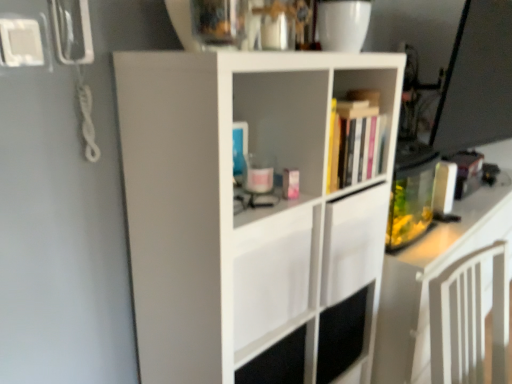
Question: Should I look upward or downward to see hardcover books at upper center?

Choices:
 (A) up
 (B) down

Answer: (A)

Question: Can we say hardcover books at upper center lies outside white matte cupboard at center?

Choices:
 (A) yes
 (B) no

Answer: (B)

Question: Is hardcover books at upper center oriented away from white matte cupboard at center?

Choices:
 (A) no
 (B) yes

Answer: (B)

Question: Is hardcover books at upper center wider than white matte cupboard at center?

Choices:
 (A) yes
 (B) no

Answer: (B)

Question: From a real-world perspective, is hardcover books at upper center over white matte cupboard at center?

Choices:
 (A) no
 (B) yes

Answer: (B)

Question: Is hardcover books at upper center not close to white matte cupboard at center?

Choices:
 (A) yes
 (B) no

Answer: (B)

Question: Could white matte cupboard at center be considered to be inside hardcover books at upper center?

Choices:
 (A) no
 (B) yes

Answer: (A)

Question: Are white matte cupboard at center and hardcover books at upper center beside each other?

Choices:
 (A) no
 (B) yes

Answer: (A)

Question: From the image's perspective, would you say white matte cupboard at center is positioned over hardcover books at upper center?

Choices:
 (A) no
 (B) yes

Answer: (A)

Question: Does white matte cupboard at center appear on the left side of hardcover books at upper center?

Choices:
 (A) no
 (B) yes

Answer: (B)

Question: Can you confirm if white matte cupboard at center is shorter than hardcover books at upper center?

Choices:
 (A) no
 (B) yes

Answer: (A)

Question: Could you tell me if white matte cupboard at center is turned towards hardcover books at upper center?

Choices:
 (A) no
 (B) yes

Answer: (B)

Question: Can you confirm if white matte cupboard at center is taller than hardcover books at upper center?

Choices:
 (A) no
 (B) yes

Answer: (B)

Question: Visually, is white matte cupboard at center positioned to the left or to the right of hardcover books at upper center?

Choices:
 (A) left
 (B) right

Answer: (A)